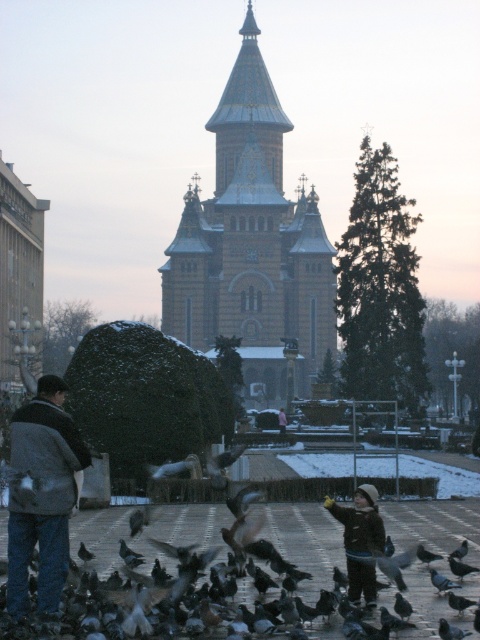
Who is lower down, gray feathered pigeon at center or pink fabric jacket at center?

gray feathered pigeon at center

Is point (93, 554) farther from viewer compared to point (284, 413)?

No, (93, 554) is in front of (284, 413).

Locate an element on the screen. The height and width of the screenshot is (640, 480). gray feathered pigeon at center is located at coordinates (84, 552).

Looking at this image, can you confirm if dark brown winter coat at lower center is taller than pink fabric jacket at center?

Indeed, dark brown winter coat at lower center has a greater height compared to pink fabric jacket at center.

Is the position of dark brown winter coat at lower center more distant than that of pink fabric jacket at center?

No.

Describe the element at coordinates (360, 540) in the screenshot. This screenshot has width=480, height=640. I see `dark brown winter coat at lower center` at that location.

In order to click on dark brown winter coat at lower center in this screenshot , I will do `click(360, 540)`.

Can you confirm if dark brown winter coat at lower center is bigger than gray feathered pigeon at center?

Yes.

Does dark brown winter coat at lower center have a lesser height compared to gray feathered pigeon at center?

In fact, dark brown winter coat at lower center may be taller than gray feathered pigeon at center.

Is point (375, 509) in front of point (81, 548)?

Yes, point (375, 509) is closer to viewer.

You are a GUI agent. You are given a task and a screenshot of the screen. Output one action in this format:
    pyautogui.click(x=<x>, y=<y>)
    Task: Click on the dark brown winter coat at lower center
    
    Given the screenshot: What is the action you would take?
    pyautogui.click(x=360, y=540)